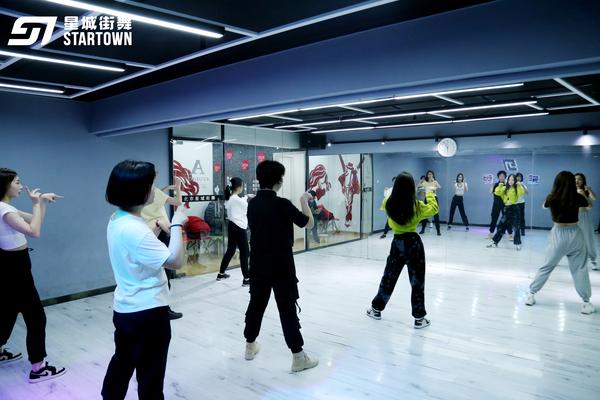
Find the location of a particular element. The height and width of the screenshot is (400, 600). floor is located at coordinates (484, 340).